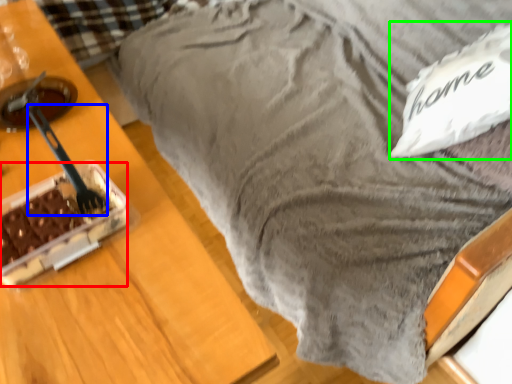
Question: Based on their relative distances, which object is farther from cake (highlighted by a red box)? Choose from utensil (highlighted by a blue box) and pillow (highlighted by a green box).

Choices:
 (A) utensil
 (B) pillow

Answer: (B)